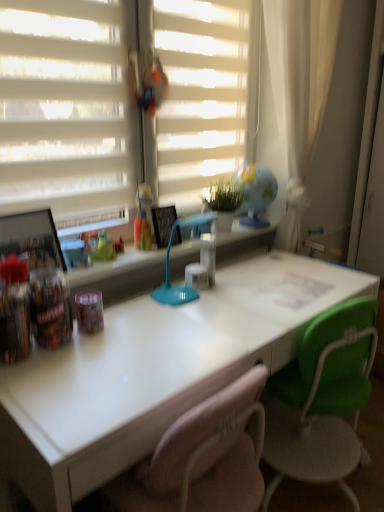
Question: Is white glossy desk at center outside blue plastic table lamp at center?

Choices:
 (A) yes
 (B) no

Answer: (A)

Question: Considering the relative positions of white glossy desk at center and blue plastic table lamp at center in the image provided, is white glossy desk at center to the left of blue plastic table lamp at center from the viewer's perspective?

Choices:
 (A) yes
 (B) no

Answer: (B)

Question: Can you confirm if white glossy desk at center is shorter than blue plastic table lamp at center?

Choices:
 (A) yes
 (B) no

Answer: (B)

Question: Considering the relative sizes of white glossy desk at center and blue plastic table lamp at center in the image provided, is white glossy desk at center smaller than blue plastic table lamp at center?

Choices:
 (A) no
 (B) yes

Answer: (A)

Question: Is white glossy desk at center surrounding blue plastic table lamp at center?

Choices:
 (A) yes
 (B) no

Answer: (B)

Question: Is white glossy desk at center thinner than blue plastic table lamp at center?

Choices:
 (A) yes
 (B) no

Answer: (B)

Question: Does blue plastic table lamp at center have a smaller size compared to white glossy desk at center?

Choices:
 (A) no
 (B) yes

Answer: (B)

Question: Is blue plastic table lamp at center closer to the viewer compared to white glossy desk at center?

Choices:
 (A) yes
 (B) no

Answer: (B)

Question: Is blue plastic table lamp at center to the left of white glossy desk at center from the viewer's perspective?

Choices:
 (A) no
 (B) yes

Answer: (B)

Question: Does blue plastic table lamp at center contain white glossy desk at center?

Choices:
 (A) yes
 (B) no

Answer: (B)

Question: Considering the relative sizes of blue plastic table lamp at center and white glossy desk at center in the image provided, is blue plastic table lamp at center taller than white glossy desk at center?

Choices:
 (A) yes
 (B) no

Answer: (B)

Question: Does blue plastic table lamp at center appear on the right side of white glossy desk at center?

Choices:
 (A) yes
 (B) no

Answer: (B)

Question: Can you confirm if translucent plastic cup at upper center is bigger than blue plastic table lamp at center?

Choices:
 (A) yes
 (B) no

Answer: (B)